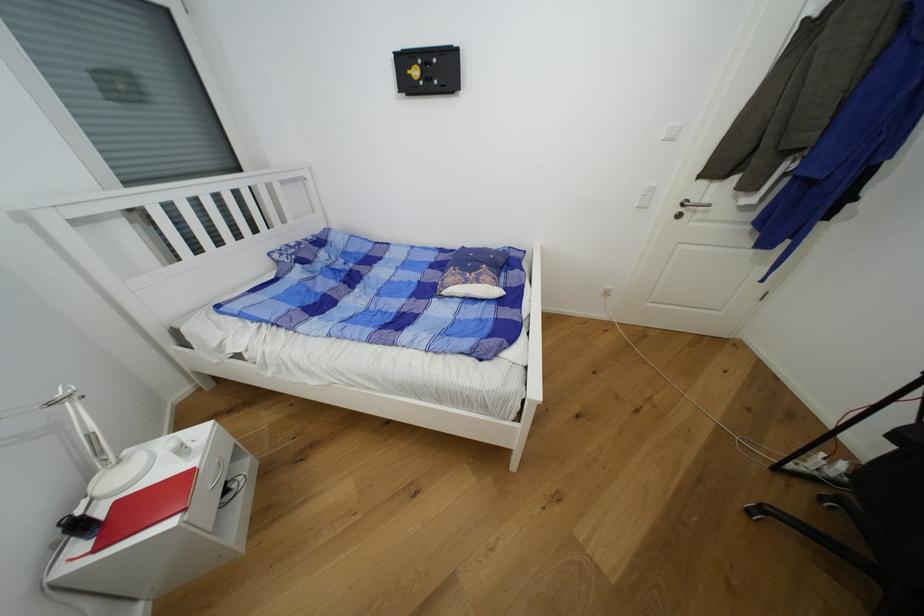
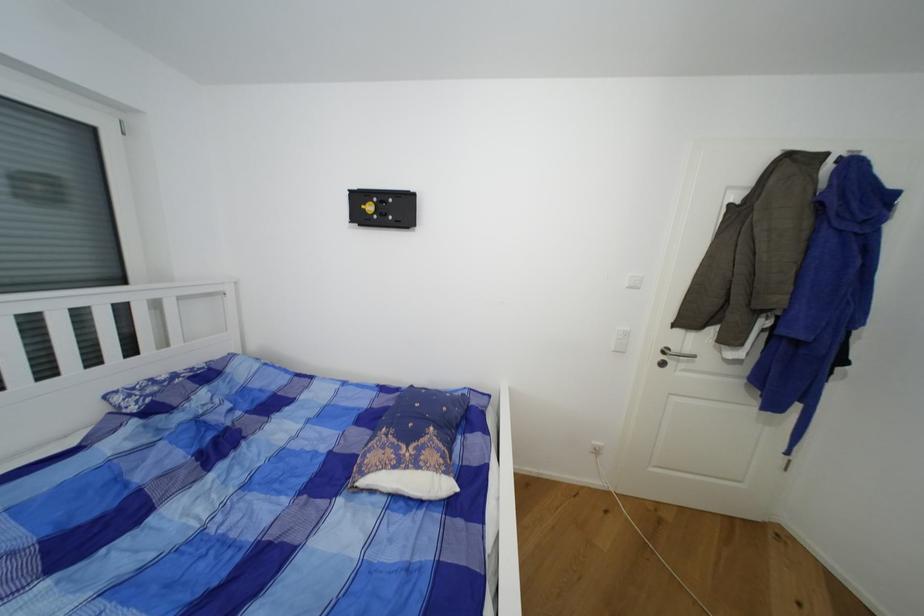
In the second image, find the point that corresponds to (x=504, y=294) in the first image.

(454, 488)